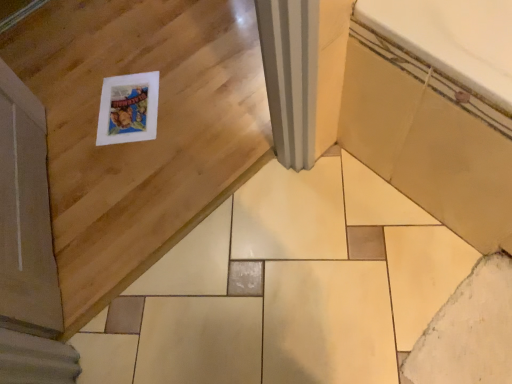
This screenshot has height=384, width=512. What do you see at coordinates (426, 127) in the screenshot?
I see `beige ceramic bathtub at lower right` at bounding box center [426, 127].

Image resolution: width=512 pixels, height=384 pixels. In order to click on beige ceramic bathtub at lower right in this screenshot , I will do click(426, 127).

Image resolution: width=512 pixels, height=384 pixels. Describe the element at coordinates (469, 331) in the screenshot. I see `white matte ceramic tile at lower right` at that location.

Image resolution: width=512 pixels, height=384 pixels. What are the coordinates of `white matte ceramic tile at lower right` in the screenshot? It's located at [469, 331].

The height and width of the screenshot is (384, 512). In order to click on beige ceramic bathtub at lower right in this screenshot , I will do `click(426, 127)`.

Does white matte ceramic tile at lower right appear on the left side of beige ceramic bathtub at lower right?

Correct, you'll find white matte ceramic tile at lower right to the left of beige ceramic bathtub at lower right.

Does white matte ceramic tile at lower right lie behind beige ceramic bathtub at lower right?

Yes, the depth of white matte ceramic tile at lower right is greater than that of beige ceramic bathtub at lower right.

Does point (494, 324) appear closer or farther from the camera than point (438, 76)?

Point (494, 324).

From the image's perspective, is white matte ceramic tile at lower right on beige ceramic bathtub at lower right?

No, from the image's perspective, white matte ceramic tile at lower right is not on top of beige ceramic bathtub at lower right.

From a real-world perspective, is white matte ceramic tile at lower right positioned over beige ceramic bathtub at lower right based on gravity?

No, from a real-world perspective, white matte ceramic tile at lower right is not over beige ceramic bathtub at lower right

Considering the relative sizes of white matte ceramic tile at lower right and beige ceramic bathtub at lower right in the image provided, is white matte ceramic tile at lower right thinner than beige ceramic bathtub at lower right?

Yes.

Which of these two, white matte ceramic tile at lower right or beige ceramic bathtub at lower right, stands taller?

With more height is beige ceramic bathtub at lower right.

Looking at the image, does white matte ceramic tile at lower right seem bigger or smaller compared to beige ceramic bathtub at lower right?

white matte ceramic tile at lower right is smaller than beige ceramic bathtub at lower right.

Which is correct: white matte ceramic tile at lower right is inside beige ceramic bathtub at lower right, or outside of it?

white matte ceramic tile at lower right is not enclosed by beige ceramic bathtub at lower right.

Is white matte ceramic tile at lower right far from beige ceramic bathtub at lower right?

No, white matte ceramic tile at lower right is in close proximity to beige ceramic bathtub at lower right.

Based on the photo, could you tell me if white matte ceramic tile at lower right is turned towards beige ceramic bathtub at lower right?

No, white matte ceramic tile at lower right is not oriented towards beige ceramic bathtub at lower right.

How many degrees apart are the facing directions of white matte ceramic tile at lower right and beige ceramic bathtub at lower right?

There is a 0.000113-degree angle between the facing directions of white matte ceramic tile at lower right and beige ceramic bathtub at lower right.

What are the coordinates of `bath above the white matte ceramic tile at lower right (from a real-world perspective)` in the screenshot? It's located at (426, 127).

Between beige ceramic bathtub at lower right and white matte ceramic tile at lower right, which one appears on the left side from the viewer's perspective?

Positioned to the left is white matte ceramic tile at lower right.

Is beige ceramic bathtub at lower right positioned behind white matte ceramic tile at lower right?

No, it is not.

Which point is more distant from viewer, (431, 90) or (509, 363)?

The point (509, 363) is farther from the camera.

Consider the image. From the image's perspective, which one is positioned lower, beige ceramic bathtub at lower right or white matte ceramic tile at lower right?

white matte ceramic tile at lower right is shown below in the image.

From a real-world perspective, is beige ceramic bathtub at lower right located beneath white matte ceramic tile at lower right?

Actually, beige ceramic bathtub at lower right is physically above white matte ceramic tile at lower right in the real world.

Does beige ceramic bathtub at lower right have a lesser width compared to white matte ceramic tile at lower right?

No.

In the scene shown: Considering the sizes of objects beige ceramic bathtub at lower right and white matte ceramic tile at lower right in the image provided, who is shorter, beige ceramic bathtub at lower right or white matte ceramic tile at lower right?

With less height is white matte ceramic tile at lower right.

Considering the sizes of objects beige ceramic bathtub at lower right and white matte ceramic tile at lower right in the image provided, who is bigger, beige ceramic bathtub at lower right or white matte ceramic tile at lower right?

Bigger between the two is beige ceramic bathtub at lower right.

Is beige ceramic bathtub at lower right located outside white matte ceramic tile at lower right?

Yes, beige ceramic bathtub at lower right is outside of white matte ceramic tile at lower right.

Are beige ceramic bathtub at lower right and white matte ceramic tile at lower right far apart?

That's not correct — beige ceramic bathtub at lower right is a little close to white matte ceramic tile at lower right.

Is beige ceramic bathtub at lower right turned away from white matte ceramic tile at lower right?

No, beige ceramic bathtub at lower right's orientation is not away from white matte ceramic tile at lower right.

How far apart are beige ceramic bathtub at lower right and white matte ceramic tile at lower right?

The distance of beige ceramic bathtub at lower right from white matte ceramic tile at lower right is 35.39 centimeters.

The image size is (512, 384). I want to click on bath lying on the right of white matte ceramic tile at lower right, so click(426, 127).

Identify the location of ceramic tile located underneath the beige ceramic bathtub at lower right (from a real-world perspective). (469, 331).

Find the location of a particular element. bath that appears above the white matte ceramic tile at lower right (from the image's perspective) is located at coordinates (426, 127).